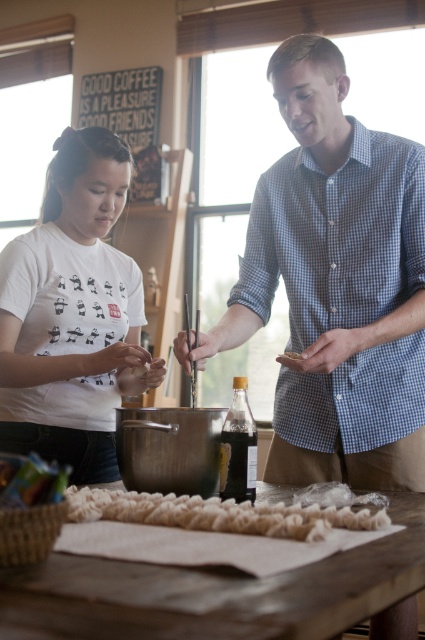
You are a guest in this kitchen and want to place a small plate between the blue checkered shirt at center and the brown crumbly food at center. Can you fit the plate there without moving either object?

The blue checkered shirt at center is bigger than brown crumbly food at center, so there might be enough space between them to place the small plate without moving either object.

You are a photographer standing in the kitchen scene. You want to take a photo that includes both the blue checkered shirt at center and the wooden table at center. Which object should be placed closer to the camera to ensure both are in focus?

The blue checkered shirt at center is much taller than the wooden table at center, so placing the wooden table at center closer to the camera would help keep both in focus since the table is shorter and can be positioned nearer to maintain depth of field.